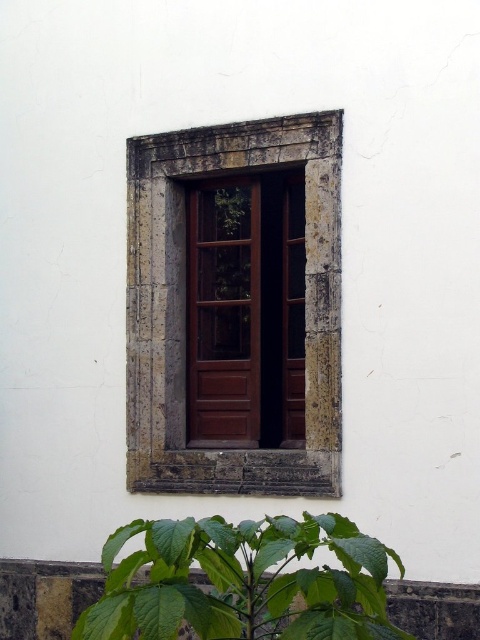
You are standing in front of the window described in the scene. There is a point marked at coordinates point (x=243, y=580). Based on the scene description, what object is located at this point?

The point (x=243, y=580) corresponds to the green leafy plant at lower center.